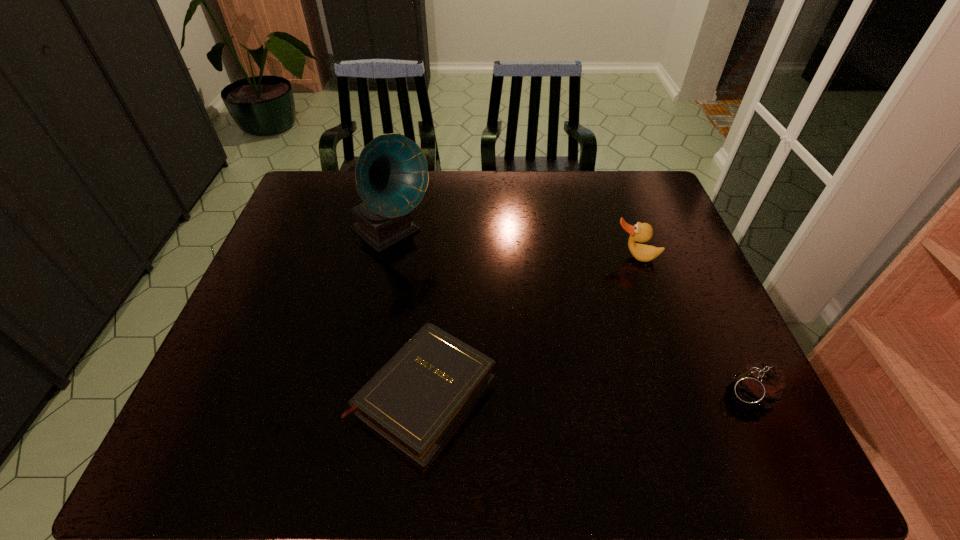
At what (x,y) coordinates should I click in order to perform the action: click on free spot located from the horn of the phonograph_record. Please return your answer as a coordinate pair (x, y). This screenshot has height=540, width=960. Looking at the image, I should click on click(x=459, y=289).

At what (x,y) coordinates should I click in order to perform the action: click on vacant space positioned from the horn of the phonograph_record. Please return your answer as a coordinate pair (x, y). The width and height of the screenshot is (960, 540). Looking at the image, I should click on (507, 328).

What are the coordinates of `vacant space located on the beak of the second object from right to left` in the screenshot? It's located at (623, 351).

Image resolution: width=960 pixels, height=540 pixels. Identify the location of free space located 0.290m on the beak of the second object from right to left. (623, 348).

Locate an element on the screen. This screenshot has width=960, height=540. blank space located on the beak of the second object from right to left is located at coordinates (622, 365).

Find the location of a particular element. Image resolution: width=960 pixels, height=540 pixels. object that is positioned at the far edge is located at coordinates (391, 174).

Identify the location of Bible that is positioned at the near edge. (x=416, y=400).

Where is `pinecone located at the near edge`? The height and width of the screenshot is (540, 960). pinecone located at the near edge is located at coordinates (762, 385).

Identify the location of pinecone located in the right edge section of the desktop. (762, 385).

Find the location of a particular element. This screenshot has width=960, height=540. duck that is at the right edge is located at coordinates (641, 232).